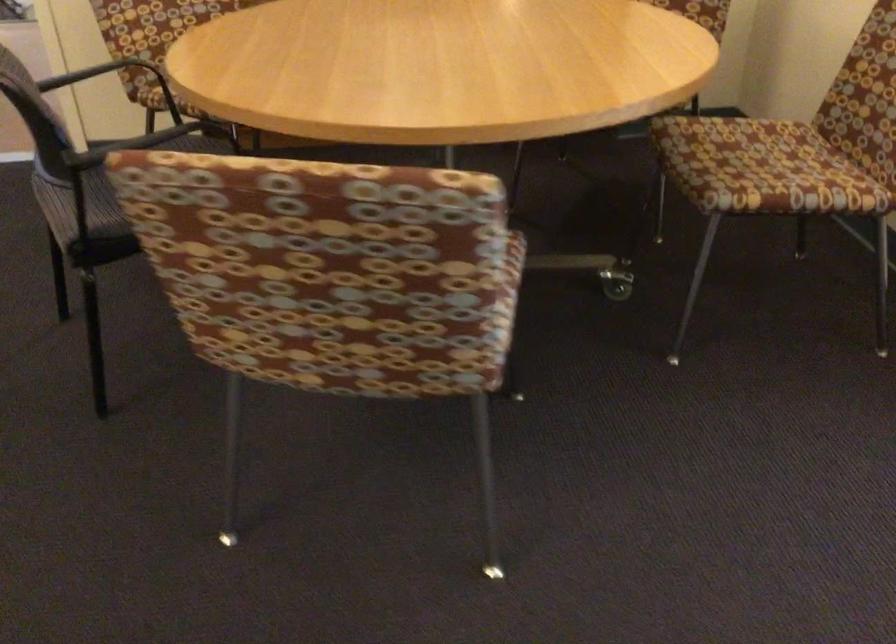
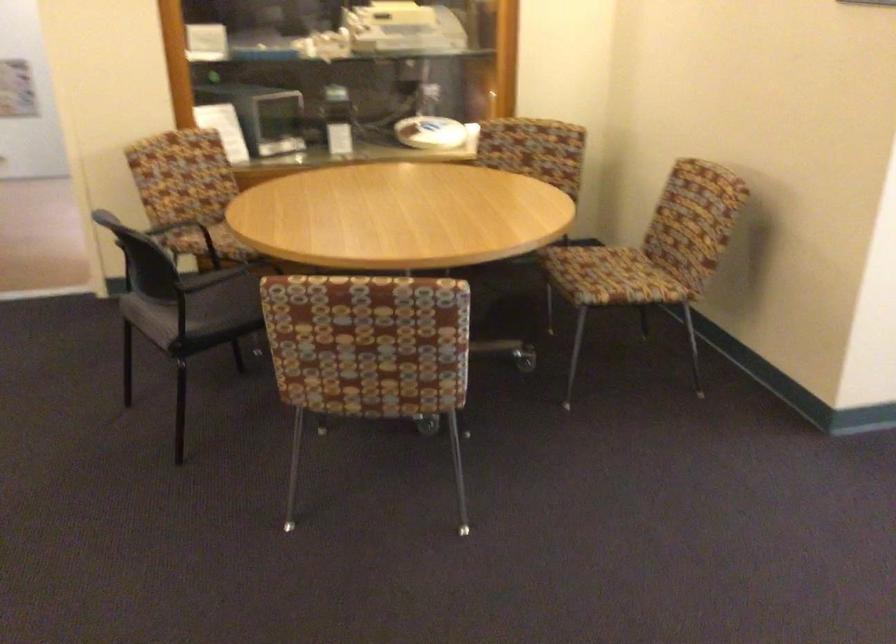
Find the pixel in the second image that matches pixel 321 303 in the first image.

(368, 353)